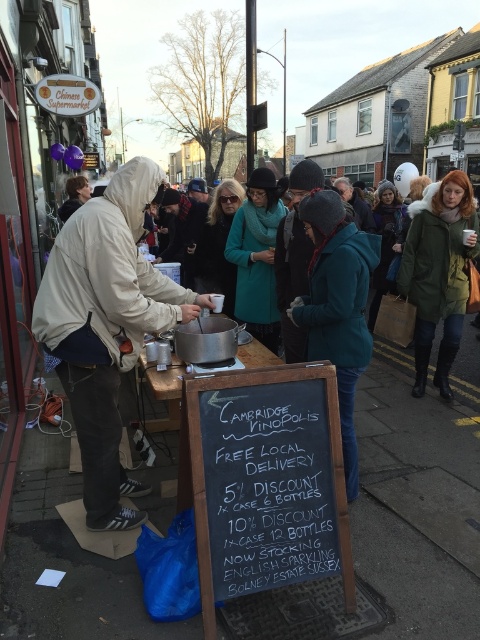
Question: Which point is closer to the camera?

Choices:
 (A) (247, 541)
 (B) (127, 320)

Answer: (A)

Question: Can you confirm if black chalkboard at center is bigger than white fleece jacket at center?

Choices:
 (A) yes
 (B) no

Answer: (B)

Question: Observing the image, what is the correct spatial positioning of black chalkboard at center in reference to white fleece jacket at center?

Choices:
 (A) below
 (B) above

Answer: (A)

Question: Which of the following is the closest to the observer?

Choices:
 (A) white fleece jacket at center
 (B) black chalkboard at center

Answer: (B)

Question: Can you confirm if black chalkboard at center is bigger than white fleece jacket at center?

Choices:
 (A) yes
 (B) no

Answer: (B)